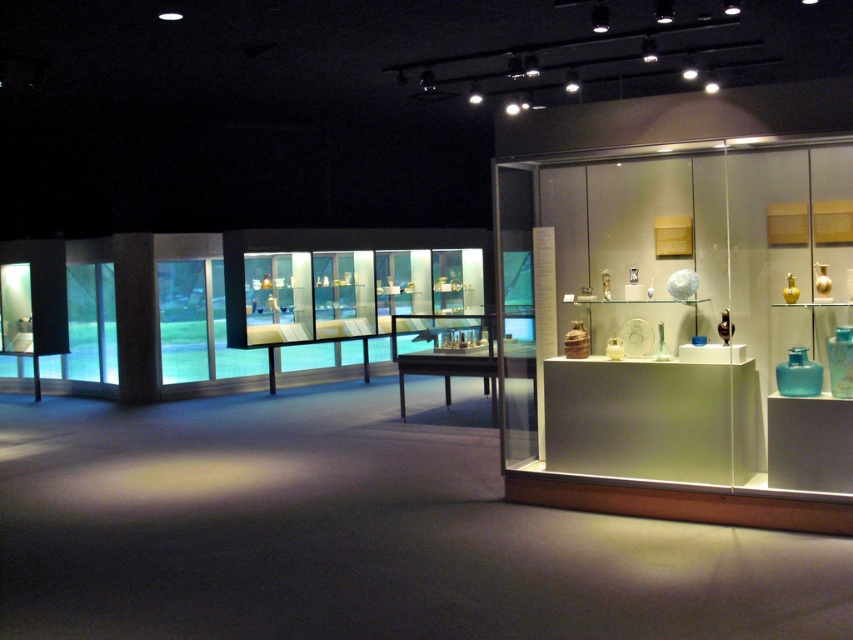
Is transparent glass vase at right closer to camera compared to teal glass vase at center?

No, it is not.

Is transparent glass vase at right to the left of teal glass vase at center from the viewer's perspective?

Indeed, transparent glass vase at right is positioned on the left side of teal glass vase at center.

Does point (805, 372) lie behind point (834, 392)?

Yes, it is behind point (834, 392).

Image resolution: width=853 pixels, height=640 pixels. What are the coordinates of `transparent glass vase at right` in the screenshot? It's located at (798, 374).

Is point (744, 484) in front of point (851, 356)?

No, it is not.

The height and width of the screenshot is (640, 853). What do you see at coordinates (682, 330) in the screenshot?
I see `translucent glass display case at right` at bounding box center [682, 330].

Locate an element on the screen. The image size is (853, 640). translucent glass display case at right is located at coordinates 682,330.

Is translucent glass display case at right above transparent glass vase at right?

Indeed, translucent glass display case at right is positioned over transparent glass vase at right.

Which of these two, translucent glass display case at right or transparent glass vase at right, stands shorter?

transparent glass vase at right is shorter.

This screenshot has height=640, width=853. I want to click on translucent glass display case at right, so click(x=682, y=330).

In order to click on translucent glass display case at right in this screenshot , I will do `click(682, 330)`.